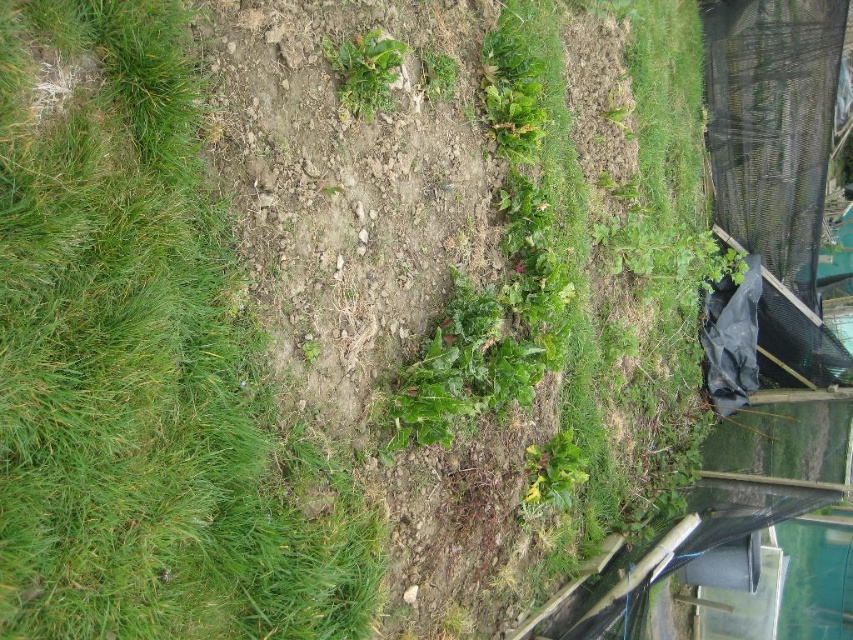
Is green grass at upper left closer to the viewer compared to green leafy plant at center?

Yes, green grass at upper left is in front of green leafy plant at center.

Which of these two, green grass at upper left or green leafy plant at center, stands shorter?

green leafy plant at center is shorter.

Which is behind, point (25, 586) or point (426, 58)?

Point (426, 58)

Find the location of `green grass at upper left`. green grass at upper left is located at coordinates (141, 369).

Does green leafy plant at upper center come in front of green leafy plant at center?

That is True.

Based on the photo, does green leafy plant at upper center appear over green leafy plant at center?

No, green leafy plant at upper center is not above green leafy plant at center.

Locate an element on the screen. Image resolution: width=853 pixels, height=640 pixels. green leafy plant at upper center is located at coordinates [364, 70].

The width and height of the screenshot is (853, 640). What are the coordinates of `green leafy plant at upper center` in the screenshot? It's located at (364, 70).

Between point (120, 262) and point (350, 42), which one is positioned behind?

Point (350, 42)

Describe the element at coordinates (141, 369) in the screenshot. The height and width of the screenshot is (640, 853). I see `green grass at upper left` at that location.

Which is in front, point (112, 179) or point (351, 74)?

Point (112, 179) is in front.

Identify the location of green grass at upper left. This screenshot has width=853, height=640. (141, 369).